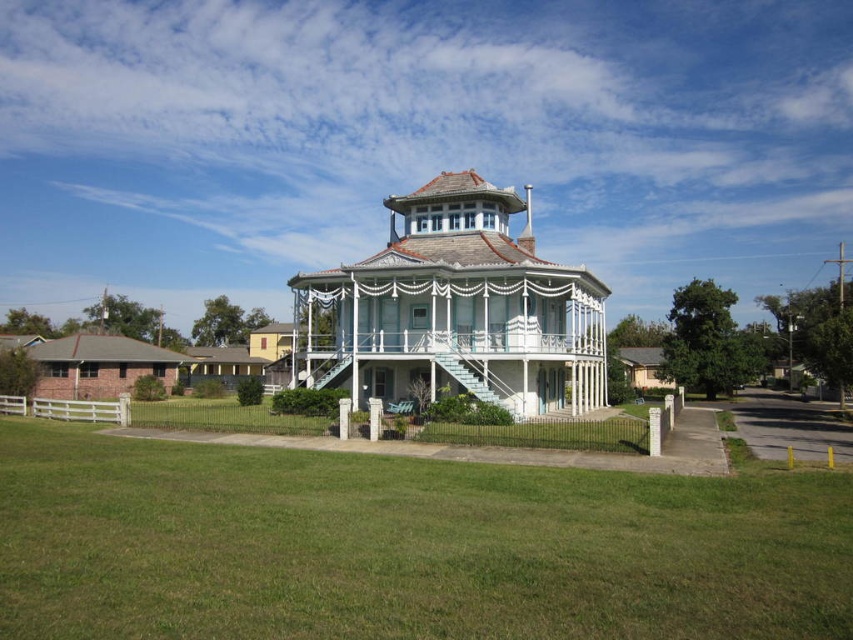
Question: Estimate the real-world distances between objects in this image. Which object is closer to the white painted wood porch at center?

Choices:
 (A) green grass at center
 (B) white painted wood gazebo at center

Answer: (B)

Question: Which object appears farthest from the camera in this image?

Choices:
 (A) white painted wood porch at center
 (B) green grass at center
 (C) white painted wood gazebo at center

Answer: (C)

Question: Which point is closer to the camera taking this photo?

Choices:
 (A) click(x=437, y=628)
 (B) click(x=338, y=323)
 (C) click(x=276, y=330)

Answer: (A)

Question: Can you confirm if green grass at center is wider than white painted wood porch at center?

Choices:
 (A) no
 (B) yes

Answer: (A)

Question: Does green grass at center appear over white painted wood porch at center?

Choices:
 (A) yes
 (B) no

Answer: (B)

Question: Does green grass at center have a smaller size compared to white painted wood porch at center?

Choices:
 (A) no
 (B) yes

Answer: (B)